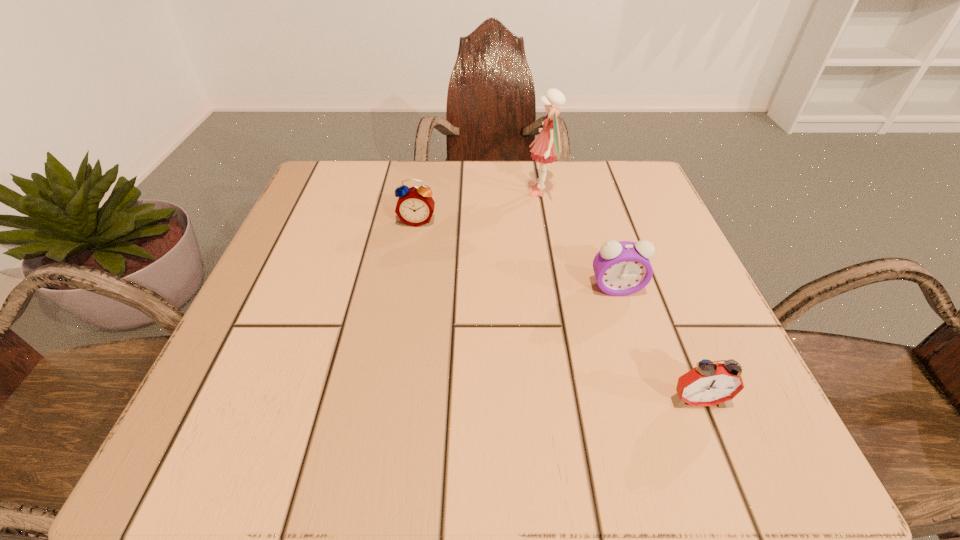
In the image, there is a desktop. Where is `vacant space at the far left corner`? The image size is (960, 540). vacant space at the far left corner is located at coordinates pyautogui.click(x=328, y=198).

Image resolution: width=960 pixels, height=540 pixels. I want to click on free space at the far right corner of the desktop, so click(660, 222).

In the image, there is a desktop. Where is `blank space at the near right corner`? Image resolution: width=960 pixels, height=540 pixels. blank space at the near right corner is located at coordinates (747, 428).

Locate an element on the screen. The height and width of the screenshot is (540, 960). unoccupied position between the second nearest object and the farthest object is located at coordinates (579, 241).

Find the location of a particular element. vacant space in between the farthest alarm clock and the farthest object is located at coordinates (479, 207).

I want to click on free space between the second nearest alarm clock and the third object from right to left, so click(x=579, y=241).

The height and width of the screenshot is (540, 960). What are the coordinates of `free spot between the doll and the second nearest object` in the screenshot? It's located at (579, 241).

Identify the location of unoccupied position between the nearest object and the leftmost object. The width and height of the screenshot is (960, 540). (558, 310).

This screenshot has width=960, height=540. I want to click on vacant point located between the second farthest alarm clock and the nearest alarm clock, so click(657, 344).

The height and width of the screenshot is (540, 960). What are the coordinates of `empty space that is in between the third nearest object and the farthest object` in the screenshot? It's located at (479, 207).